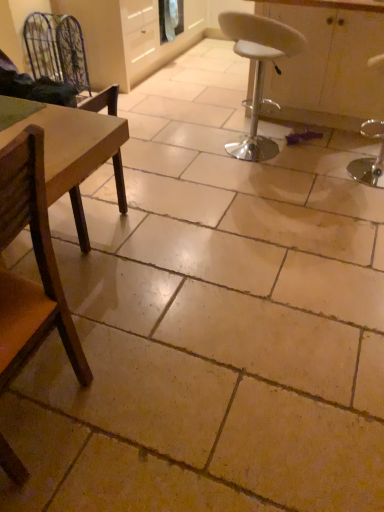
Question: From a real-world perspective, is metallic wire swivel chair at upper left over brown wooden chair at left, which ranks as the third chair in back-to-front order?

Choices:
 (A) yes
 (B) no

Answer: (B)

Question: From a real-world perspective, is metallic wire swivel chair at upper left beneath brown wooden chair at left, placed as the 2th chair when sorted from left to right?

Choices:
 (A) no
 (B) yes

Answer: (B)

Question: Is brown wooden chair at left, which ranks as the third chair in back-to-front order, at the back of metallic wire swivel chair at upper left?

Choices:
 (A) yes
 (B) no

Answer: (B)

Question: Is metallic wire swivel chair at upper left positioned before brown wooden chair at left, placed as the 2th chair when sorted from left to right?

Choices:
 (A) yes
 (B) no

Answer: (B)

Question: Can you confirm if metallic wire swivel chair at upper left is wider than brown wooden chair at left, which is the first chair in front-to-back order?

Choices:
 (A) no
 (B) yes

Answer: (A)

Question: From the image's perspective, is white plastic stool at center, the third chair positioned from the left, above or below white glossy cabinet at center?

Choices:
 (A) below
 (B) above

Answer: (A)

Question: Is point (235, 39) positioned closer to the camera than point (269, 81)?

Choices:
 (A) farther
 (B) closer

Answer: (B)

Question: Based on their sizes in the image, would you say white plastic stool at center, which is counted as the first chair, starting from the right, is bigger or smaller than white glossy cabinet at center?

Choices:
 (A) big
 (B) small

Answer: (B)

Question: Based on their positions, is white plastic stool at center, which is counted as the first chair, starting from the right, located to the left or right of white glossy cabinet at center?

Choices:
 (A) right
 (B) left

Answer: (B)

Question: Considering the positions of point (112, 158) and point (370, 80), is point (112, 158) closer or farther from the camera than point (370, 80)?

Choices:
 (A) closer
 (B) farther

Answer: (A)

Question: Is wooden chair at left, the 3th chair positioned from the right, inside or outside of white glossy cabinet at center?

Choices:
 (A) outside
 (B) inside

Answer: (A)

Question: Relative to white glossy cabinet at center, is wooden chair at left, the 3th chair positioned from the right, in front or behind?

Choices:
 (A) front
 (B) behind

Answer: (A)

Question: Considering the positions of wooden chair at left, the second chair in the back-to-front sequence, and white glossy cabinet at center in the image, is wooden chair at left, the second chair in the back-to-front sequence, wider or thinner than white glossy cabinet at center?

Choices:
 (A) thin
 (B) wide

Answer: (A)

Question: From a real-world perspective, is white glossy cabinet at center positioned above or below metallic wire swivel chair at upper left?

Choices:
 (A) below
 (B) above

Answer: (B)

Question: Relative to metallic wire swivel chair at upper left, is white glossy cabinet at center in front or behind?

Choices:
 (A) behind
 (B) front

Answer: (B)